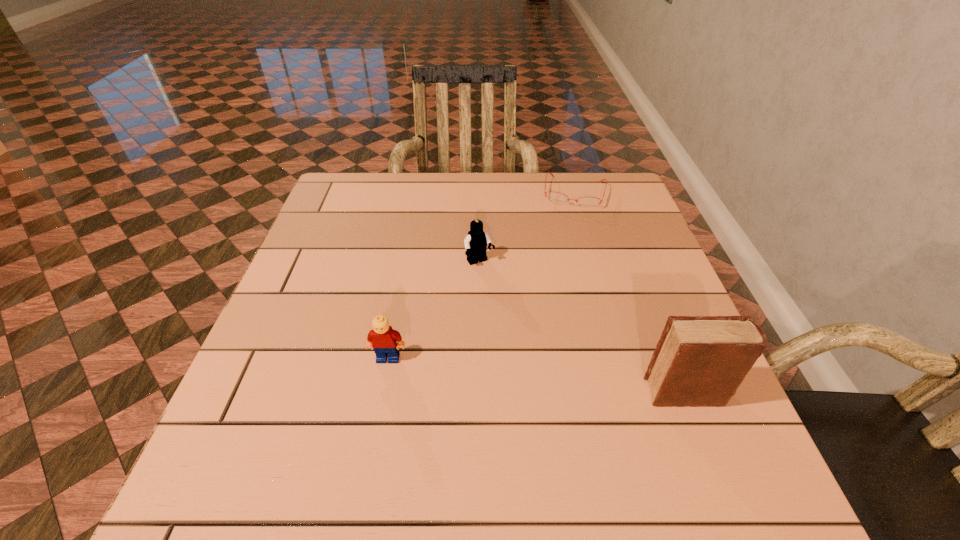
You are a GUI agent. You are given a task and a screenshot of the screen. Output one action in this format:
    pyautogui.click(x=<x>, y=<y>)
    Task: Click on the vacant region located 0.370m on the front-facing side of the farther Lego
    
    Given the screenshot: What is the action you would take?
    pyautogui.click(x=567, y=393)

This screenshot has width=960, height=540. I want to click on free spot located 0.090m on the front-facing side of the farther Lego, so click(502, 294).

You are a GUI agent. You are given a task and a screenshot of the screen. Output one action in this format:
    pyautogui.click(x=<x>, y=<y>)
    Task: Click on the vacant space located on the lenses of the shortest object
    
    Given the screenshot: What is the action you would take?
    pyautogui.click(x=564, y=252)

Find the location of a particular element. The height and width of the screenshot is (540, 960). vacant space situated on the lenses of the shortest object is located at coordinates (556, 299).

You are a GUI agent. You are given a task and a screenshot of the screen. Output one action in this format:
    pyautogui.click(x=<x>, y=<y>)
    Task: Click on the vacant space located 0.330m on the lenses of the shortest object
    This screenshot has height=540, width=960.
    Given the screenshot: What is the action you would take?
    pyautogui.click(x=557, y=290)

Where is `object present at the far edge`? object present at the far edge is located at coordinates (557, 198).

This screenshot has width=960, height=540. I want to click on object that is at the near edge, so click(x=700, y=361).

Find the location of a particular element. The width and height of the screenshot is (960, 540). diary located in the right edge section of the desktop is located at coordinates (700, 361).

The height and width of the screenshot is (540, 960). Find the location of `spectacles positioned at the right edge`. spectacles positioned at the right edge is located at coordinates (557, 198).

Identify the location of object at the far right corner. The width and height of the screenshot is (960, 540). (557, 198).